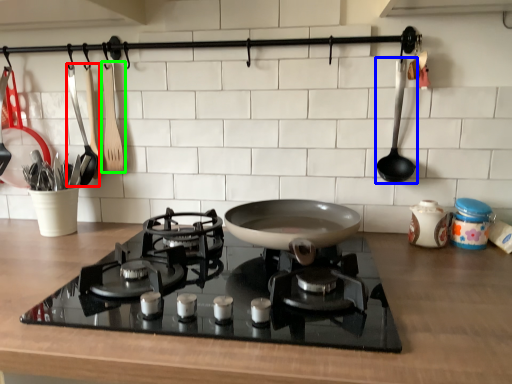
Question: Which is nearer to the kitchen appliance (highlighted by a red box)? spoon (highlighted by a blue box) or kitchen appliance (highlighted by a green box).

Choices:
 (A) spoon
 (B) kitchen appliance

Answer: (B)